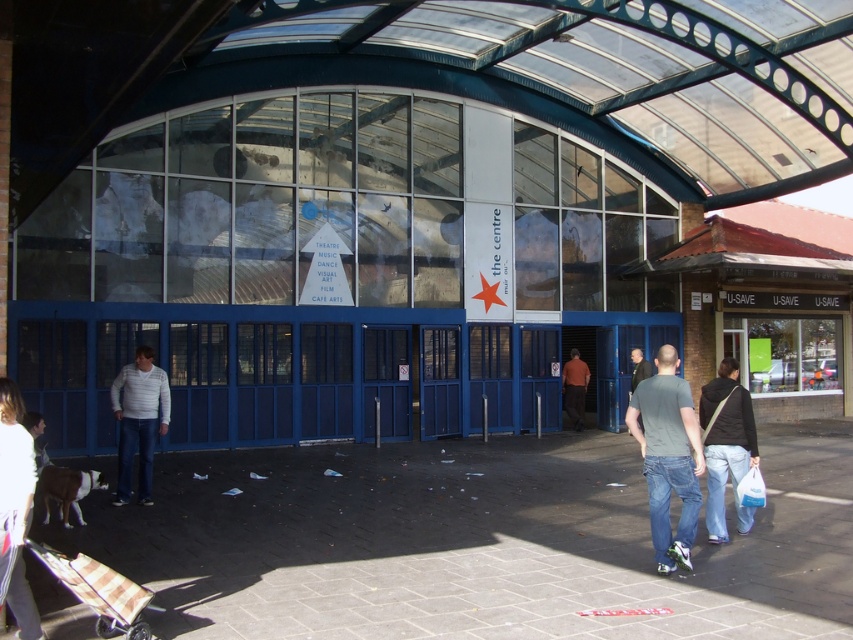
Question: Is black fabric bag at lower right above white sweater at center?

Choices:
 (A) yes
 (B) no

Answer: (A)

Question: Among these objects, which one is farthest from the camera?

Choices:
 (A) white cotton sweater at lower left
 (B) black fabric bag at lower right

Answer: (B)

Question: Among these objects, which one is farthest from the camera?

Choices:
 (A) white sweater at center
 (B) white cotton sweater at lower left

Answer: (A)

Question: Does matte gray t-shirt at center appear under black fabric bag at lower right?

Choices:
 (A) no
 (B) yes

Answer: (A)

Question: Which object is farther from the camera taking this photo?

Choices:
 (A) matte gray t-shirt at center
 (B) black fabric bag at lower right
 (C) white sweater at center

Answer: (C)

Question: Can you confirm if matte gray t-shirt at center is wider than white sweater at center?

Choices:
 (A) yes
 (B) no

Answer: (B)